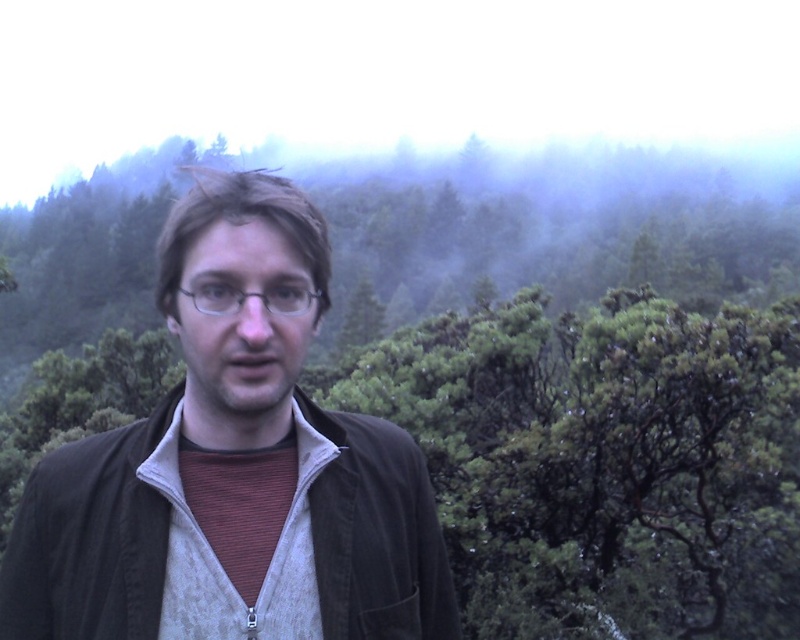
Is point (277, 573) farther from viewer compared to point (220, 305)?

Yes, point (277, 573) is behind point (220, 305).

Which is in front, point (304, 604) or point (308, 291)?

Positioned in front is point (308, 291).

Locate an element on the screen. This screenshot has width=800, height=640. brown fabric jacket at center is located at coordinates (232, 472).